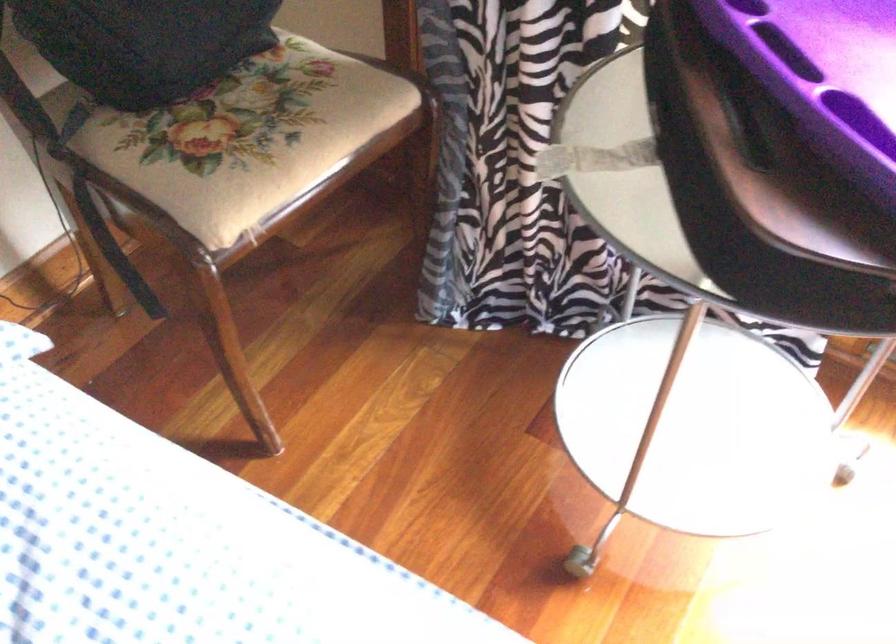
Find where to sit the floral chair sitting surface. Please return your answer as a coordinate pair (x, y).

(259, 145)